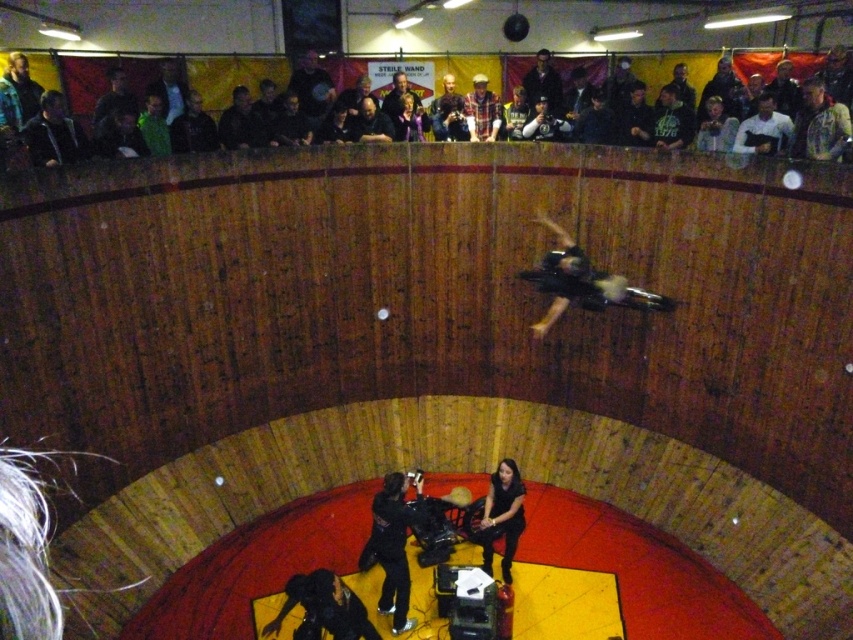
Who is taller, black matte skateboard at center or dark blue jacket at upper left?

dark blue jacket at upper left is taller.

Can you confirm if black matte skateboard at center is bigger than dark blue jacket at upper left?

Indeed, black matte skateboard at center has a larger size compared to dark blue jacket at upper left.

Is point (537, 220) farther from viewer compared to point (44, 124)?

Yes, it is behind point (44, 124).

I want to click on black matte skateboard at center, so click(581, 282).

Is point (544, 282) positioned in front of point (670, 145)?

That is True.

Does black matte skateboard at center have a greater width compared to dark green jersey at upper center?

Yes, black matte skateboard at center is wider than dark green jersey at upper center.

The image size is (853, 640). Describe the element at coordinates (581, 282) in the screenshot. I see `black matte skateboard at center` at that location.

What are the coordinates of `black matte skateboard at center` in the screenshot? It's located at (581, 282).

From the picture: Can you confirm if dark blue jacket at upper center is positioned to the left of dark brown leather jacket at upper center?

Correct, you'll find dark blue jacket at upper center to the left of dark brown leather jacket at upper center.

Image resolution: width=853 pixels, height=640 pixels. What do you see at coordinates (241, 122) in the screenshot?
I see `dark blue jacket at upper center` at bounding box center [241, 122].

This screenshot has width=853, height=640. What are the coordinates of `dark blue jacket at upper center` in the screenshot? It's located at (241, 122).